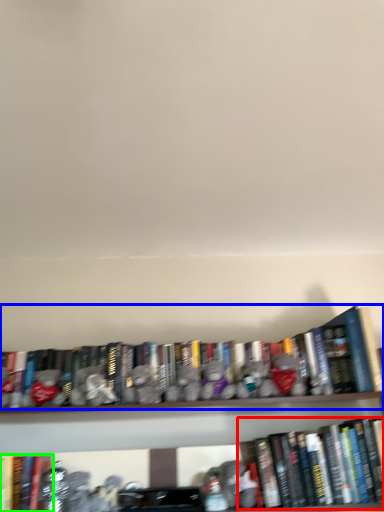
Question: Estimate the real-world distances between objects in this image. Which object is farther from book (highlighted by a red box), book (highlighted by a blue box) or book (highlighted by a green box)?

Choices:
 (A) book
 (B) book

Answer: (B)